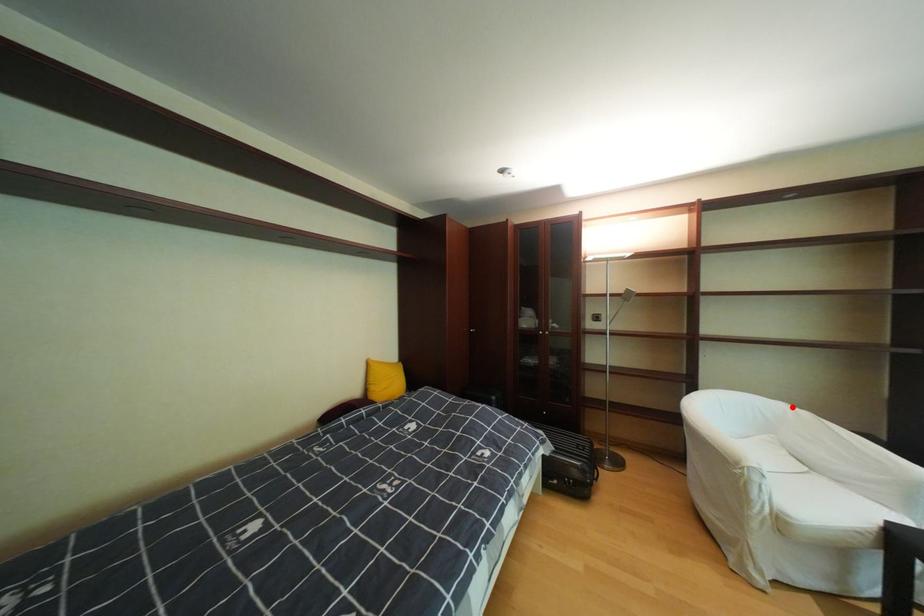
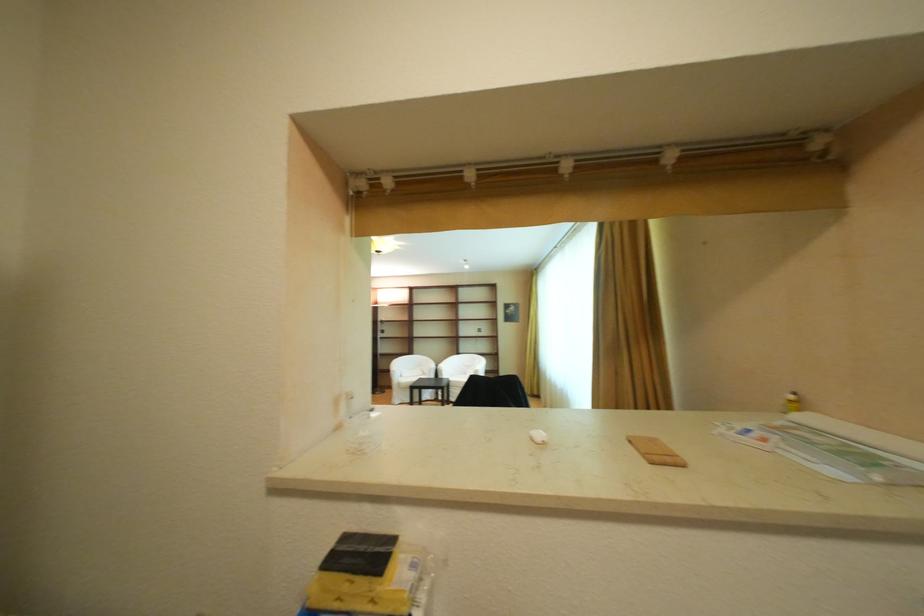
Find the pixel in the second image that matches the highlighted location in the first image.

(436, 359)